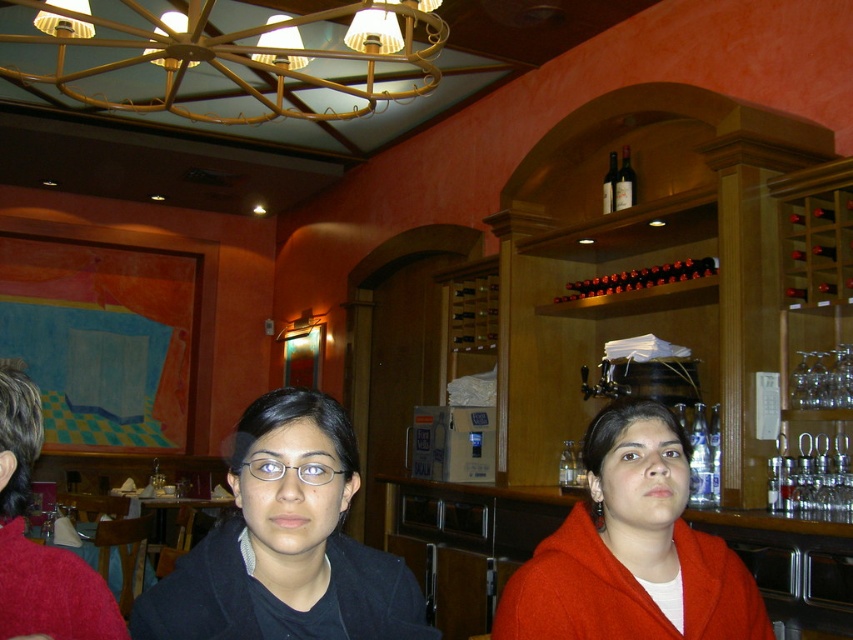
You are a customer at this restaurant and want to place your matte orange coat at center on the table between you and the brown glass bottles at upper center. Considering their widths, will the coat fit without overlapping the bottles?

The matte orange coat at center is narrower than the brown glass bottles at upper center, so placing it on the table might cause the coat to overlap with the bottles since the coat is narrower but the bottles are wider. However, the exact arrangement depends on the table size and positioning not specified here.

You are a bartender preparing a drink and need to grab the brown glass bottles at upper center and the dark glass bottle at upper center. Which one is easier to reach without moving your position?

The brown glass bottles at upper center is closer to the viewer than the dark glass bottle at upper center, so it is easier to reach without moving your position.

You are standing at the point marked as point (602,282) and want to reach the exit located at the opposite side of the room. The minimum distance you can move is 3 meters. Can you safely reach the exit without exceeding your movement limit?

The distance between you and the exit is 3.56 meters, which exceeds your minimum movement limit of 3 meters. Therefore, you cannot safely reach the exit without exceeding your movement limit.